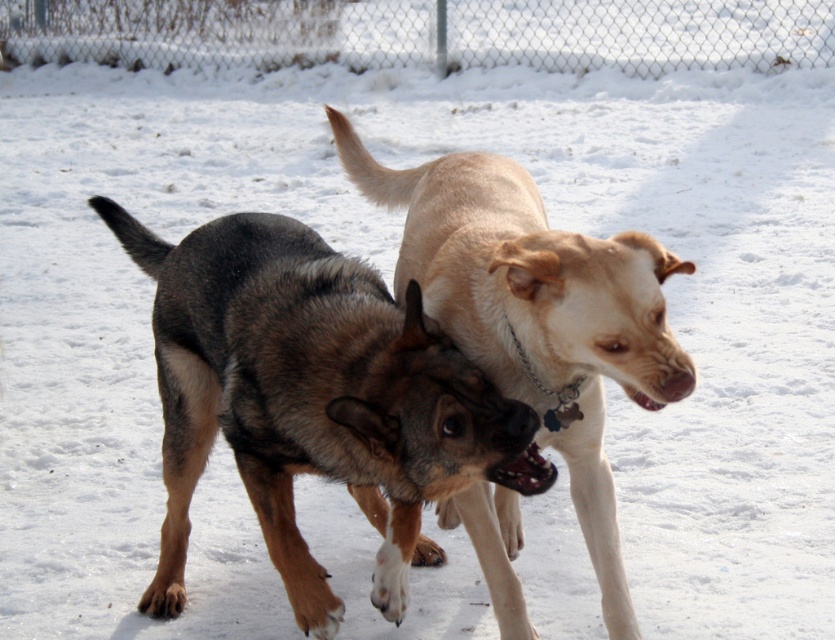
Question: Is brown fur dog at center below light brown fur dog at center?

Choices:
 (A) yes
 (B) no

Answer: (A)

Question: Among these objects, which one is farthest from the camera?

Choices:
 (A) chain-link fence at upper center
 (B) brown fur dog at center
 (C) light brown fur dog at center

Answer: (A)

Question: Which object is farther from the camera taking this photo?

Choices:
 (A) light brown fur dog at center
 (B) chain-link fence at upper center
 (C) brown fur dog at center

Answer: (B)

Question: Does light brown fur dog at center appear on the left side of chain-link fence at upper center?

Choices:
 (A) no
 (B) yes

Answer: (A)

Question: Does brown fur dog at center appear on the left side of light brown fur dog at center?

Choices:
 (A) yes
 (B) no

Answer: (A)

Question: Among these points, which one is farthest from the camera?

Choices:
 (A) (606, 369)
 (B) (281, 492)
 (C) (626, 44)

Answer: (C)